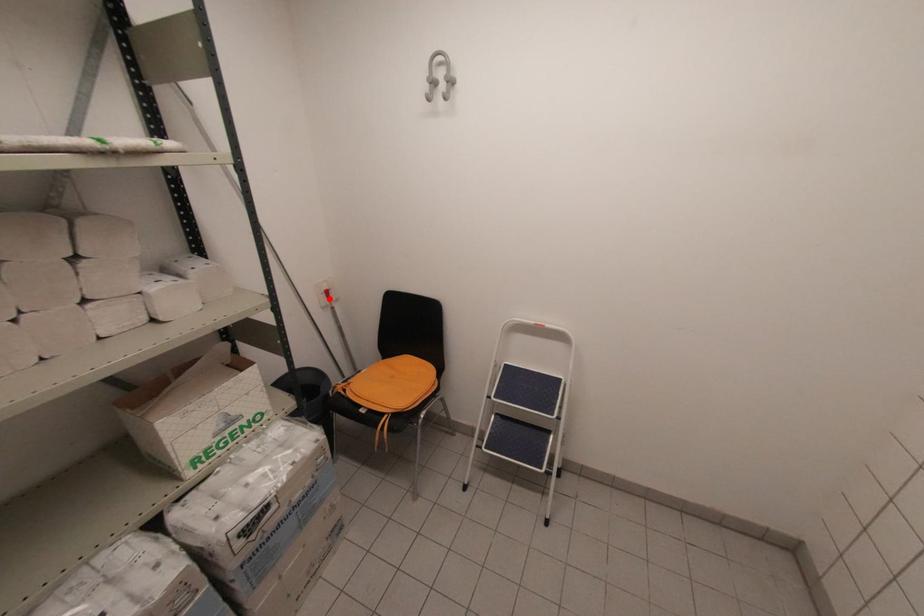
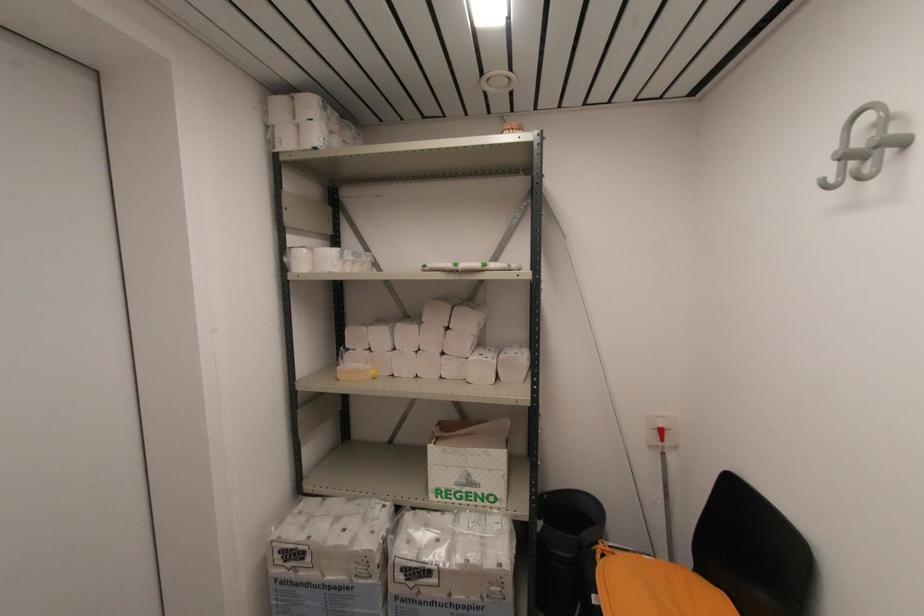
Where in the second image is the point corresponding to the highlighted location from the first image?

(663, 439)